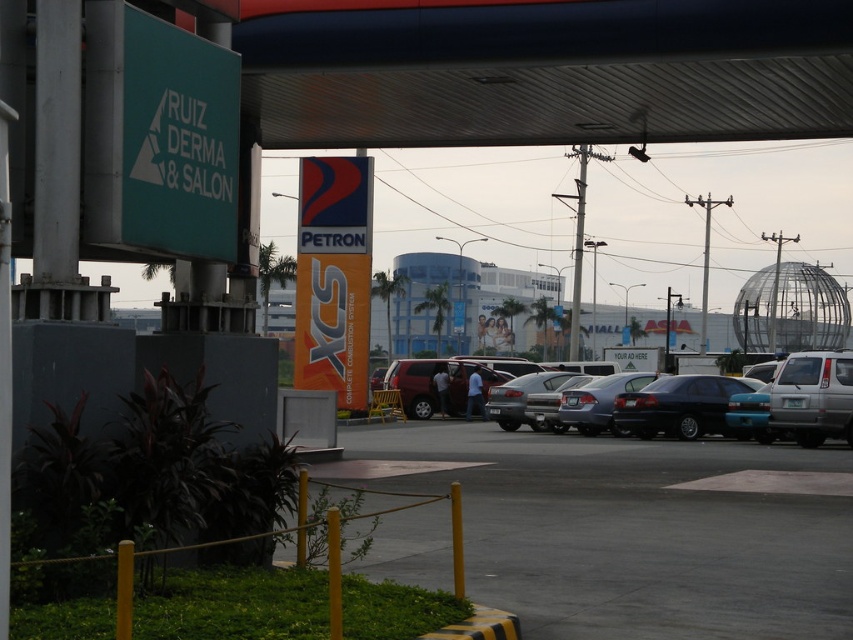
This screenshot has height=640, width=853. What do you see at coordinates (630, 531) in the screenshot?
I see `smooth asphalt parking lot at lower center` at bounding box center [630, 531].

Does point (654, 563) lie behind point (640, 381)?

That is False.

Locate an element on the screen. smooth asphalt parking lot at lower center is located at coordinates (630, 531).

Between smooth asphalt parking lot at lower center and dark blue sedan at center, which one appears on the right side from the viewer's perspective?

dark blue sedan at center is more to the right.

This screenshot has width=853, height=640. What are the coordinates of `smooth asphalt parking lot at lower center` in the screenshot? It's located at (630, 531).

The image size is (853, 640). I want to click on smooth asphalt parking lot at lower center, so click(630, 531).

Which is above, matte black sedan at center or dark blue sedan at center?

matte black sedan at center is higher up.

Which is in front, point (519, 416) or point (671, 376)?

Point (671, 376) is more forward.

Does point (699, 388) lie in front of point (689, 392)?

No, it is not.

Locate an element on the screen. The width and height of the screenshot is (853, 640). matte black sedan at center is located at coordinates (537, 404).